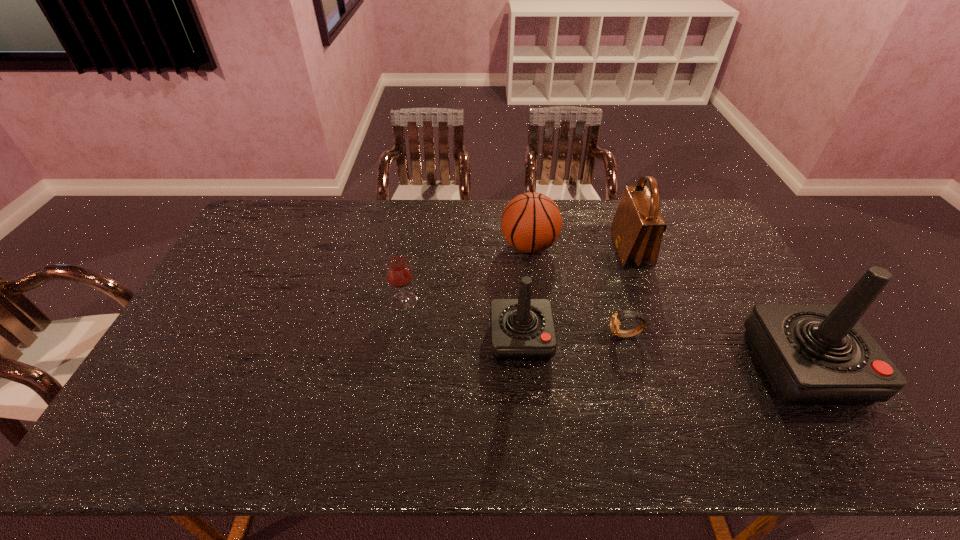
Choose which object is the third nearest neighbor to the basketball. Please provide its 2D coordinates. Your answer should be formatted as a tuple, i.e. [(x, y)], where the tuple contains the x and y coordinates of a point satisfying the conditions above.

[(616, 318)]

Where is `object that is the fourth closest to the basketball`? The height and width of the screenshot is (540, 960). object that is the fourth closest to the basketball is located at coordinates (399, 273).

This screenshot has height=540, width=960. Identify the location of free space that satisfies the following two spatial constraints: 1. on the front flap of the shoulder bag; 2. on the front-facing side of the shorter joystick. (664, 339).

Where is `vacant position in the image that satisfies the following two spatial constraints: 1. on the front flap of the fifth object from left to right; 2. on the front-facing side of the shorter joystick`? vacant position in the image that satisfies the following two spatial constraints: 1. on the front flap of the fifth object from left to right; 2. on the front-facing side of the shorter joystick is located at coordinates (664, 339).